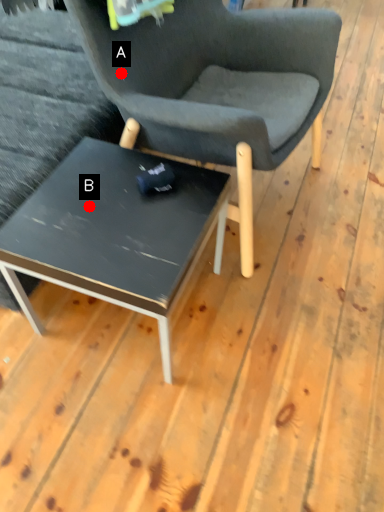
Question: Two points are circled on the image, labeled by A and B beside each circle. Among these points, which one is nearest to the camera?

Choices:
 (A) A is closer
 (B) B is closer

Answer: (B)